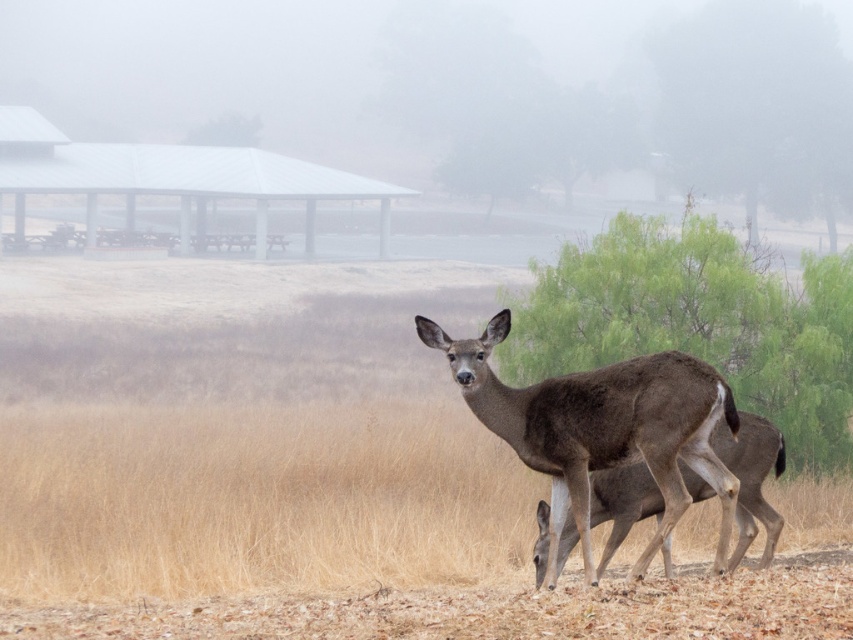
Question: Can you confirm if white plastic shelter at upper left is bigger than brown matte/deer at center?

Choices:
 (A) no
 (B) yes

Answer: (B)

Question: Is brown fur deer at center bigger than white plastic shelter at upper left?

Choices:
 (A) no
 (B) yes

Answer: (A)

Question: Which object is the closest to the brown matte/deer at center?

Choices:
 (A) white plastic shelter at upper left
 (B) brown fur deer at center

Answer: (B)

Question: Which object appears farthest from the camera in this image?

Choices:
 (A) white plastic shelter at upper left
 (B) brown matte/deer at center

Answer: (A)

Question: Does white plastic shelter at upper left have a lesser width compared to brown matte/deer at center?

Choices:
 (A) no
 (B) yes

Answer: (A)

Question: Which of these objects is positioned closest to the brown matte/deer at center?

Choices:
 (A) brown fur deer at center
 (B) white plastic shelter at upper left

Answer: (A)